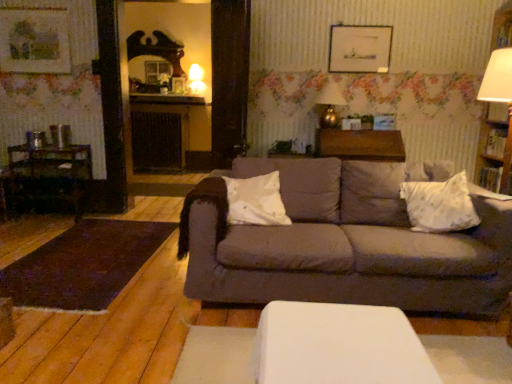
Question: Based on their sizes in the image, would you say white textured pillow at right is bigger or smaller than wooden picture frame at upper center, which appears as the 2th picture frame when viewed from the left?

Choices:
 (A) big
 (B) small

Answer: (A)

Question: From their relative heights in the image, would you say white textured pillow at right is taller or shorter than wooden picture frame at upper center, which appears as the 2th picture frame when viewed from the left?

Choices:
 (A) tall
 (B) short

Answer: (B)

Question: Based on their relative distances, which object is nearer to the matte gold table lamp at upper center, acting as the first table lamp starting from the front?

Choices:
 (A) wooden bookshelf at right
 (B) wooden picture frame at upper center, which appears as the 2th picture frame when viewed from the left
 (C) wooden picture frame at upper left, the first picture frame in the left-to-right sequence
 (D) matte white glass table lamp at upper center, the second table lamp when ordered from front to back
 (E) white textured pillow at right

Answer: (B)

Question: Which object is positioned closest to the wooden picture frame at upper center, which appears as the 2th picture frame when viewed from the left?

Choices:
 (A) wooden bookshelf at right
 (B) wooden dark chair at left
 (C) white soft pillow at center
 (D) wooden table at center
 (E) white textured pillow at right

Answer: (D)